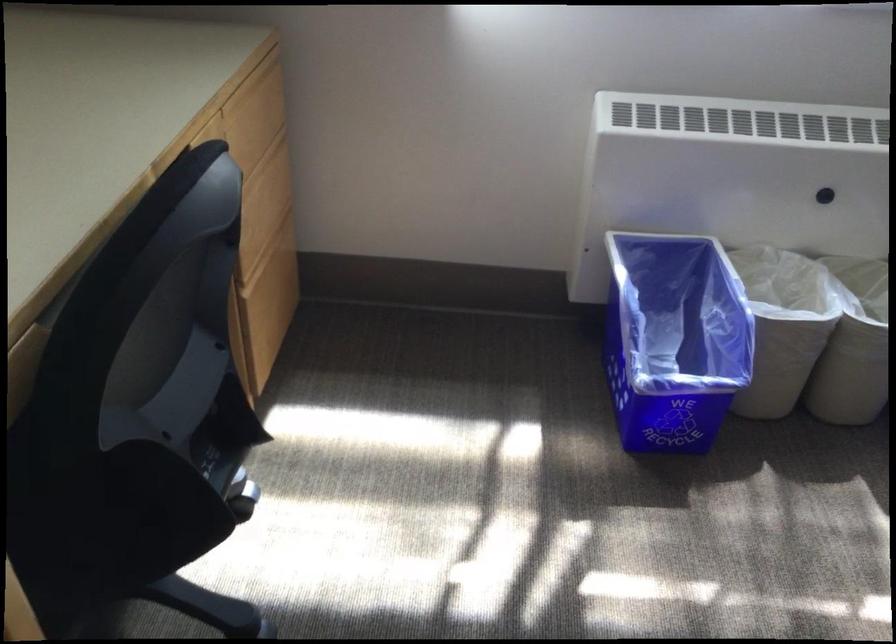
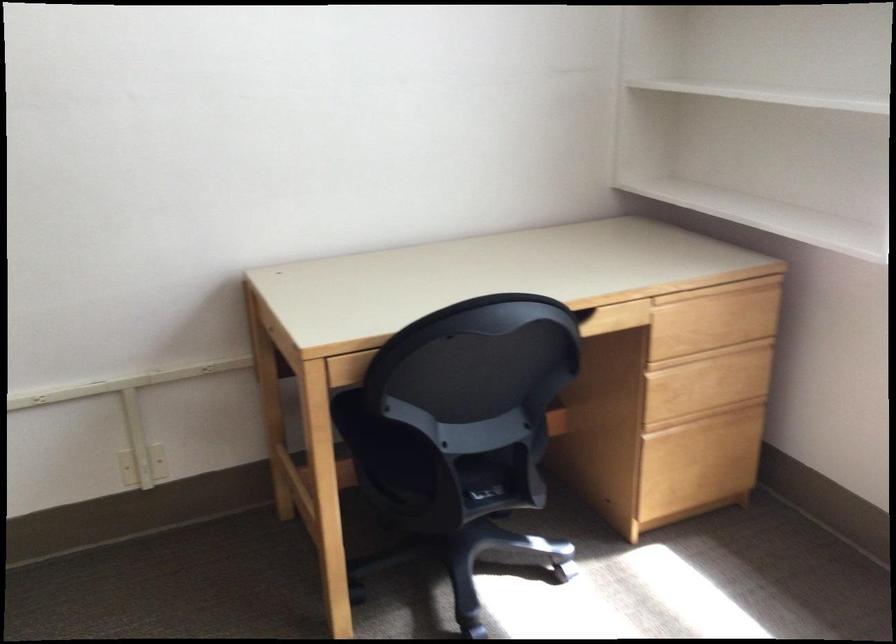
Where in the second image is the point corresponding to pixel 252 80 from the first image?

(720, 287)